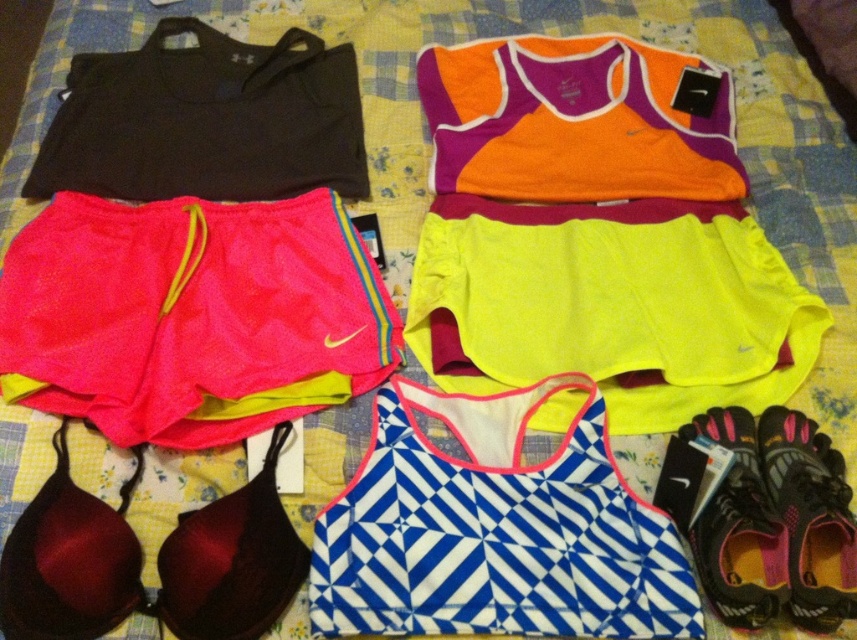
Question: Is pink mesh shorts at lower left closer to camera compared to black mesh shoe at lower right?

Choices:
 (A) yes
 (B) no

Answer: (B)

Question: Can you confirm if blue and white geometric sports bra at center is thinner than black fabric shorts at upper left?

Choices:
 (A) no
 (B) yes

Answer: (B)

Question: Estimate the real-world distances between objects in this image. Which object is closer to the orange/purple fabric bikini top at upper center?

Choices:
 (A) pink mesh shorts at lower left
 (B) blue and white geometric sports bra at center
 (C) black mesh shoe at lower right

Answer: (A)

Question: Which point is closer to the camera?

Choices:
 (A) orange/purple fabric bikini top at upper center
 (B) pink mesh shoe at lower right
 (C) pink mesh shorts at lower left
 (D) black fabric shorts at upper left

Answer: (B)

Question: Can you confirm if black fabric shorts at upper left is smaller than pink mesh shoe at lower right?

Choices:
 (A) no
 (B) yes

Answer: (A)

Question: Which object appears farthest from the camera in this image?

Choices:
 (A) pink mesh shoe at lower right
 (B) black fabric shorts at upper left

Answer: (B)